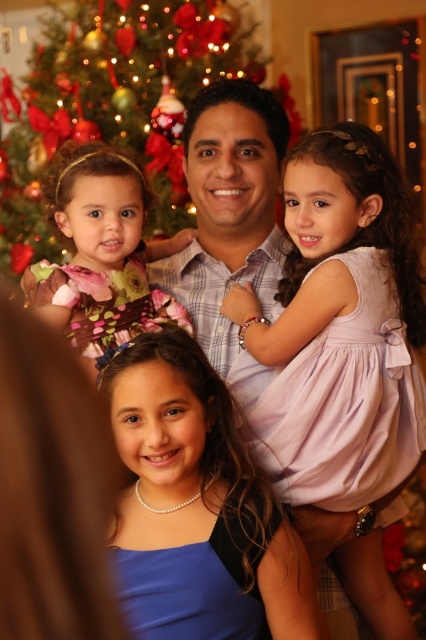
Question: Does blue satin dress at center have a larger size compared to decorated christmas tree at upper left?

Choices:
 (A) yes
 (B) no

Answer: (B)

Question: Is pink satin dress at center further to the viewer compared to blue satin dress at center?

Choices:
 (A) no
 (B) yes

Answer: (B)

Question: Which of the following is the closest to the observer?

Choices:
 (A) blue satin dress at center
 (B) floral dress at upper left
 (C) pink satin dress at center
 (D) decorated christmas tree at upper left

Answer: (A)

Question: Which object appears farthest from the camera in this image?

Choices:
 (A) plaid shirt at center
 (B) floral dress at upper left
 (C) pink satin dress at center

Answer: (A)

Question: Is decorated christmas tree at upper left to the left of plaid shirt at center from the viewer's perspective?

Choices:
 (A) no
 (B) yes

Answer: (B)

Question: Which object appears closest to the camera in this image?

Choices:
 (A) blue satin dress at center
 (B) decorated christmas tree at upper left
 (C) pink satin dress at center

Answer: (A)